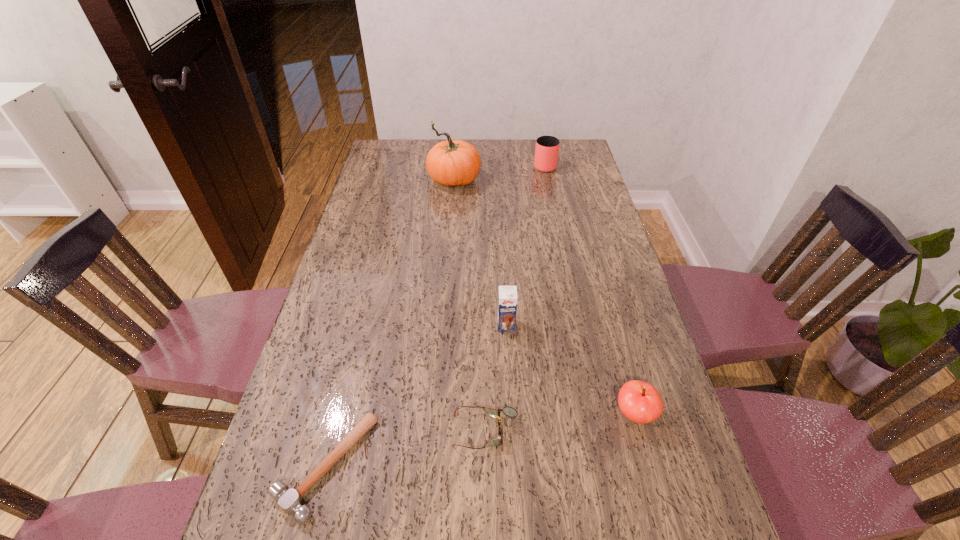
Find the location of a particular element. This screenshot has width=960, height=540. free area in between the second shortest object and the tallest object is located at coordinates (469, 306).

Identify the location of empty location between the cup and the tallest object. (499, 173).

Locate an element on the screen. The image size is (960, 540). vacant area that lies between the third shortest object and the shortest object is located at coordinates (480, 440).

You are a GUI agent. You are given a task and a screenshot of the screen. Output one action in this format:
    pyautogui.click(x=<x>, y=<y>)
    Task: Click on the object that is the closest to the third shortest object
    
    Given the screenshot: What is the action you would take?
    pyautogui.click(x=508, y=411)

The width and height of the screenshot is (960, 540). Find the location of `the fourth closest object to the cup`. the fourth closest object to the cup is located at coordinates (508, 411).

The image size is (960, 540). Identify the location of vacant region that satisfies the following two spatial constraints: 1. on the front label of the fourth nearest object; 2. on the left side of the fourth tallest object. [x=511, y=414].

Where is `vacant region that satisfies the following two spatial constraints: 1. on the front label of the fourth nearest object; 2. on the front-facing side of the spectacles`? vacant region that satisfies the following two spatial constraints: 1. on the front label of the fourth nearest object; 2. on the front-facing side of the spectacles is located at coordinates (512, 431).

What are the coordinates of `vacant area that satisfies the following two spatial constraints: 1. on the front label of the chocolate milk; 2. on the front-facing side of the spectacles` in the screenshot? It's located at (512, 431).